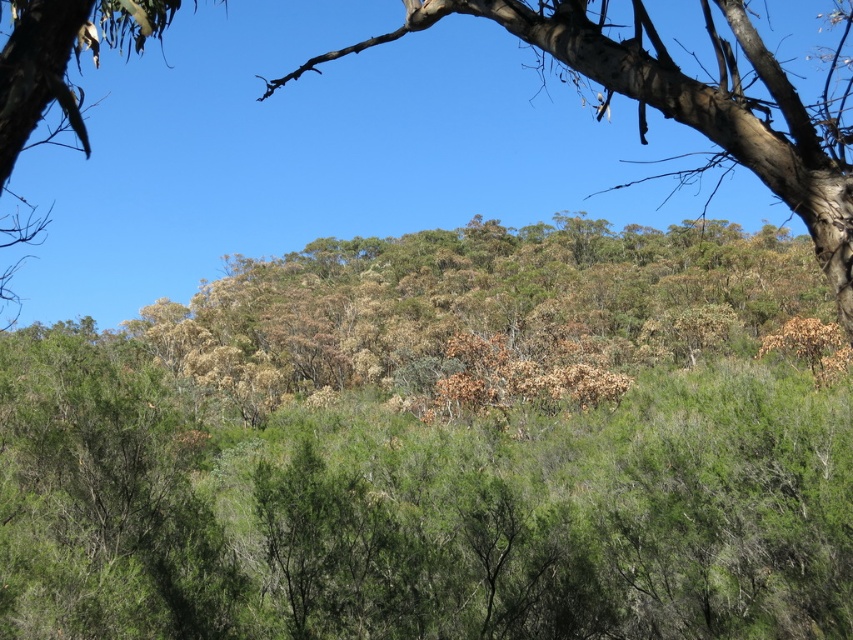
You are standing at the point marked as point (607,381) in the image. A hiker wants to know how far they are from you. Can you tell them the distance?

The distance between point (607,381) and the viewer is 126.69 feet.